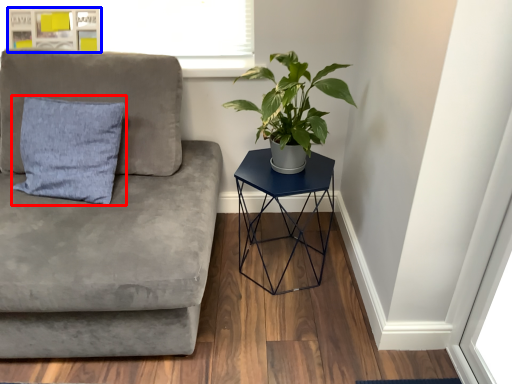
Question: Which object is closer to the camera taking this photo, pillow (highlighted by a red box) or bulletin board (highlighted by a blue box)?

Choices:
 (A) pillow
 (B) bulletin board

Answer: (A)